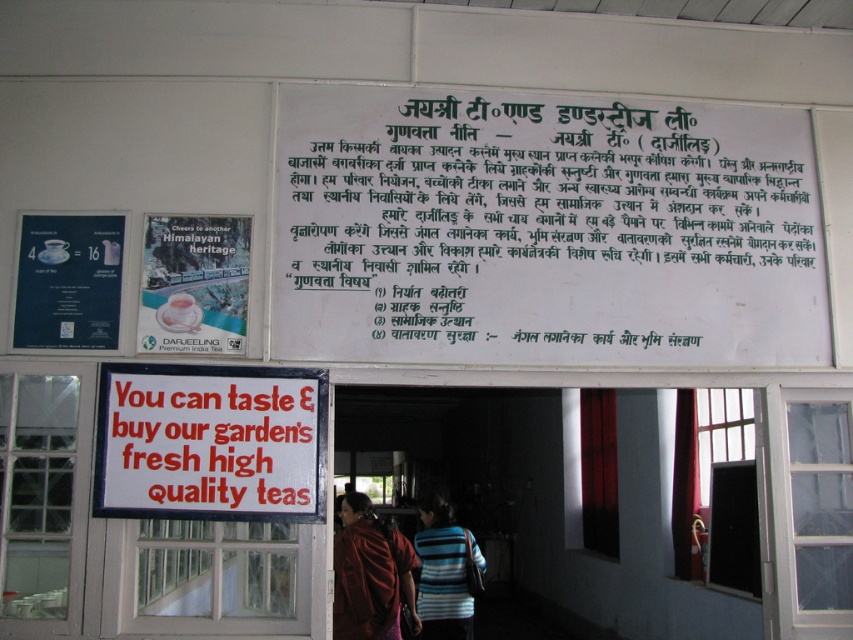
You are standing in front of the tea shop entrance and want to read the main signboard. Where should you look to find the white paper at center?

The white paper at center is located at the 2D coordinates point [544,230].